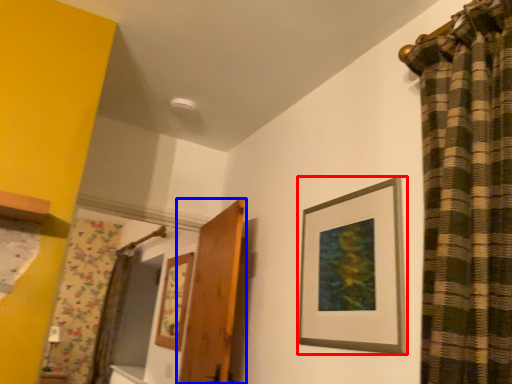
Question: Which object appears farthest to the camera in this image, picture frame (highlighted by a red box) or door (highlighted by a blue box)?

Choices:
 (A) picture frame
 (B) door

Answer: (B)